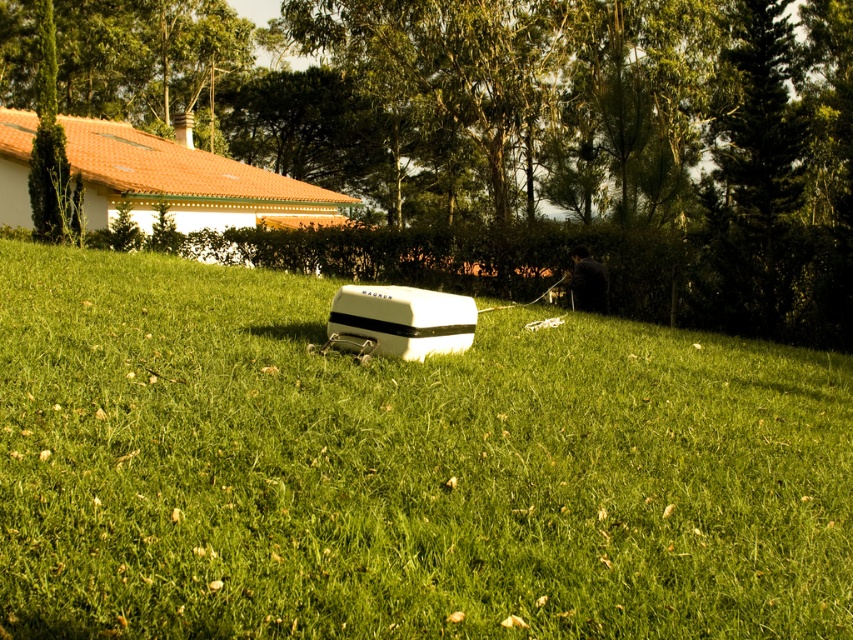
Can you confirm if green grassy at center is positioned to the left of green leafy tree at center?

In fact, green grassy at center is to the right of green leafy tree at center.

Who is taller, green grassy at center or green leafy tree at center?

With more height is green leafy tree at center.

Which is behind, point (143, 576) or point (734, 64)?

The point (734, 64) is more distant.

This screenshot has height=640, width=853. In order to click on green grassy at center in this screenshot , I will do `click(401, 468)`.